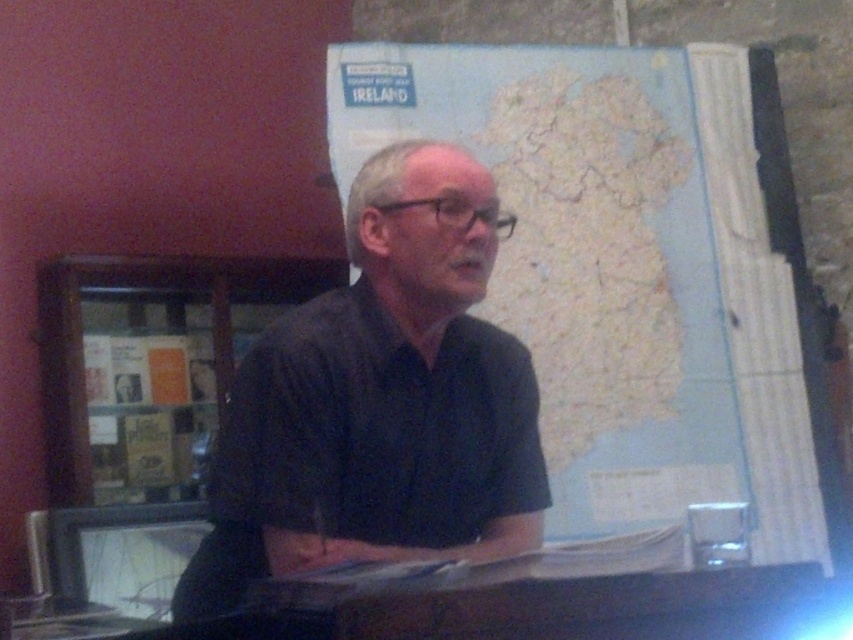
Question: Which of these objects is positioned closest to the black matte shirt at center?

Choices:
 (A) wooden frame at upper left
 (B) light blue paper map at upper center
 (C) matte plastic computer screen at lower left

Answer: (B)

Question: Which of the following is the closest to the observer?

Choices:
 (A) light blue paper map at upper center
 (B) wooden frame at upper left

Answer: (A)

Question: Which point is farther to the camera?

Choices:
 (A) matte plastic computer screen at lower left
 (B) light blue paper map at upper center
 (C) wooden frame at upper left
 (D) black matte shirt at center

Answer: (C)

Question: Does black matte shirt at center have a larger size compared to matte plastic computer screen at lower left?

Choices:
 (A) yes
 (B) no

Answer: (A)

Question: Does light blue paper map at upper center appear on the left side of matte plastic computer screen at lower left?

Choices:
 (A) no
 (B) yes

Answer: (A)

Question: Is light blue paper map at upper center smaller than black matte shirt at center?

Choices:
 (A) yes
 (B) no

Answer: (B)